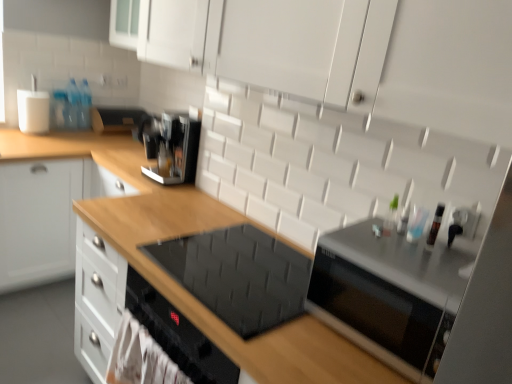
Question: From a real-world perspective, is satin black toaster at upper center, the 1th appliance in the back-to-front sequence, located beneath wooden drawer at left?

Choices:
 (A) yes
 (B) no

Answer: (B)

Question: Considering the relative positions of satin black toaster at upper center, arranged as the 1th appliance when viewed from the left, and wooden drawer at left in the image provided, is satin black toaster at upper center, arranged as the 1th appliance when viewed from the left, to the left of wooden drawer at left from the viewer's perspective?

Choices:
 (A) no
 (B) yes

Answer: (A)

Question: Considering the relative sizes of satin black toaster at upper center, arranged as the 2th appliance when ordered from the bottom, and wooden drawer at left in the image provided, is satin black toaster at upper center, arranged as the 2th appliance when ordered from the bottom, shorter than wooden drawer at left?

Choices:
 (A) no
 (B) yes

Answer: (B)

Question: Is satin black toaster at upper center, the 1th appliance in the back-to-front sequence, further to the viewer compared to wooden drawer at left?

Choices:
 (A) yes
 (B) no

Answer: (A)

Question: Is satin black toaster at upper center, the 1th appliance in the back-to-front sequence, at the right side of wooden drawer at left?

Choices:
 (A) no
 (B) yes

Answer: (B)

Question: Considering their positions, is black glass cooktop at center located in front of or behind transparent plastic bottle at upper right, which is the 1th bottle in bottom-to-top order?

Choices:
 (A) front
 (B) behind

Answer: (A)

Question: In terms of height, does black glass cooktop at center look taller or shorter compared to transparent plastic bottle at upper right, the 1th bottle from the right?

Choices:
 (A) short
 (B) tall

Answer: (B)

Question: Considering the positions of black glass cooktop at center and transparent plastic bottle at upper right, which is the 1th bottle in bottom-to-top order, in the image, is black glass cooktop at center wider or thinner than transparent plastic bottle at upper right, which is the 1th bottle in bottom-to-top order,?

Choices:
 (A) thin
 (B) wide

Answer: (B)

Question: Is point (218, 221) positioned closer to the camera than point (437, 210)?

Choices:
 (A) closer
 (B) farther

Answer: (B)

Question: From a real-world perspective, is sleek metallic coffee maker at upper center above or below satin black toaster at upper center, the 2th appliance when ordered from front to back?

Choices:
 (A) above
 (B) below

Answer: (A)

Question: Considering the positions of sleek metallic coffee maker at upper center and satin black toaster at upper center, the 2th appliance when ordered from front to back, in the image, is sleek metallic coffee maker at upper center wider or thinner than satin black toaster at upper center, the 2th appliance when ordered from front to back,?

Choices:
 (A) thin
 (B) wide

Answer: (B)

Question: Is sleek metallic coffee maker at upper center taller or shorter than satin black toaster at upper center, the 2th appliance from the right?

Choices:
 (A) short
 (B) tall

Answer: (B)

Question: Is point (157, 167) positioned closer to the camera than point (105, 117)?

Choices:
 (A) closer
 (B) farther

Answer: (A)

Question: From a real-world perspective, is transparent plastic bottle at upper right, which is the 1th bottle in bottom-to-top order, positioned above or below black glass cooktop at center?

Choices:
 (A) above
 (B) below

Answer: (A)

Question: Is transparent plastic bottle at upper right, the first bottle in the front-to-back sequence, wider or thinner than black glass cooktop at center?

Choices:
 (A) thin
 (B) wide

Answer: (A)